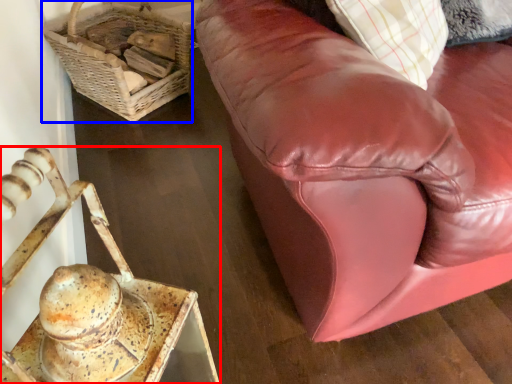
Question: Among these objects, which one is farthest to the camera, furniture (highlighted by a red box) or basket (highlighted by a blue box)?

Choices:
 (A) furniture
 (B) basket

Answer: (B)